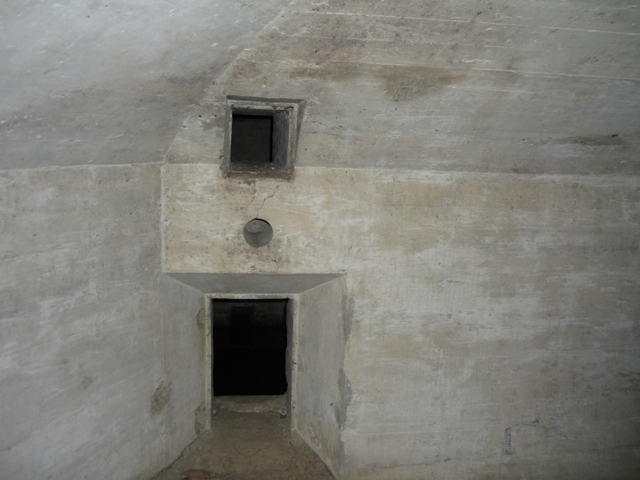
At what (x,y) coordinates should I click in order to perform the action: click on cement ceiling. Please return your answer as a coordinate pair (x, y). Looking at the image, I should click on (269, 289), (400, 73), (143, 42).